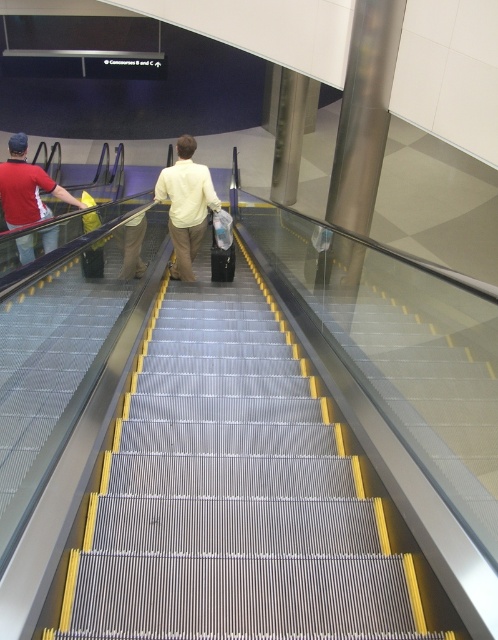
You are standing at the bottom of the escalator and notice the metallic silver stairs at center and the light yellow shirt at center. Which object is closer to the ground?

The metallic silver stairs at center is closer to the ground because it has a lesser height compared to the light yellow shirt at center.

You are standing at the bottom of the escalator and want to reach the top. There are two objects in your view, the metallic silver stairs at center and the light yellow shirt at center. If you start moving towards the top, which object will you encounter first?

The light yellow shirt at center will be encountered first because it is closer to the observer at 3.06 meters away from the metallic silver stairs at center, meaning the shirt is in front of the stairs along the path upwards.